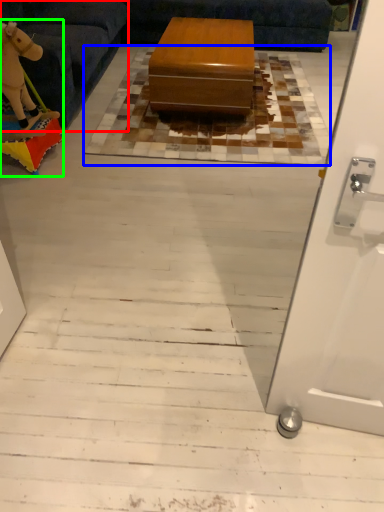
Question: Which object is positioned closest to furniture (highlighted by a red box)? Select from mat (highlighted by a blue box) and toy (highlighted by a green box).

Choices:
 (A) mat
 (B) toy

Answer: (B)